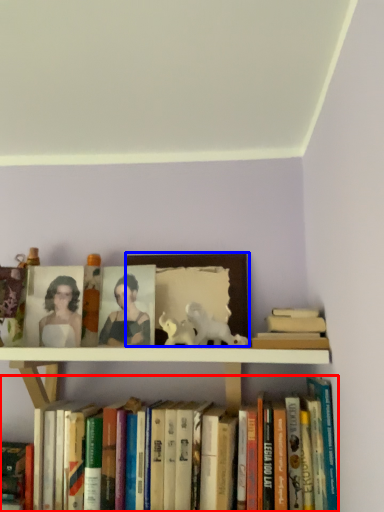
Question: Which object is closer to the camera taking this photo, book (highlighted by a red box) or picture frame (highlighted by a blue box)?

Choices:
 (A) book
 (B) picture frame

Answer: (A)